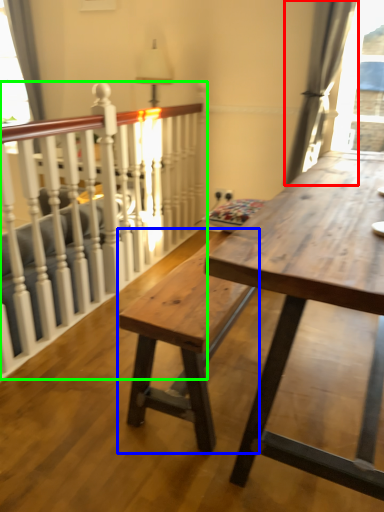
Question: Based on their relative distances, which object is farther from curtain (highlighted by a red box)? Choose from bench (highlighted by a blue box) and rail (highlighted by a green box).

Choices:
 (A) bench
 (B) rail

Answer: (A)